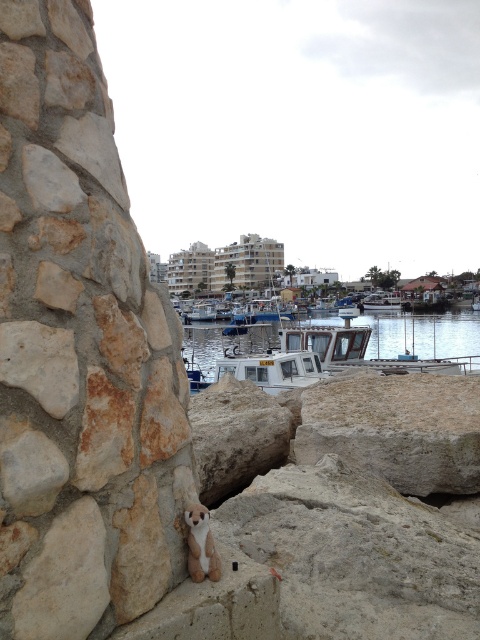
You are standing at the waterfront scene. You see two points marked on the image. The first point is at coordinate point(287, 324) and the second point is at point(396, 310). Which point is closer to you?

Point(287, 324) is in front of point(396, 310), so it is closer to you.

You are a photographer trying to capture the reflection of the white plastic boat at center in the clear water at center. Based on the scene description, will the reflection be fully visible in the water?

The clear water at center has a greater height compared to white plastic boat at center, so the reflection of the white plastic boat at center will be fully visible in the clear water at center.